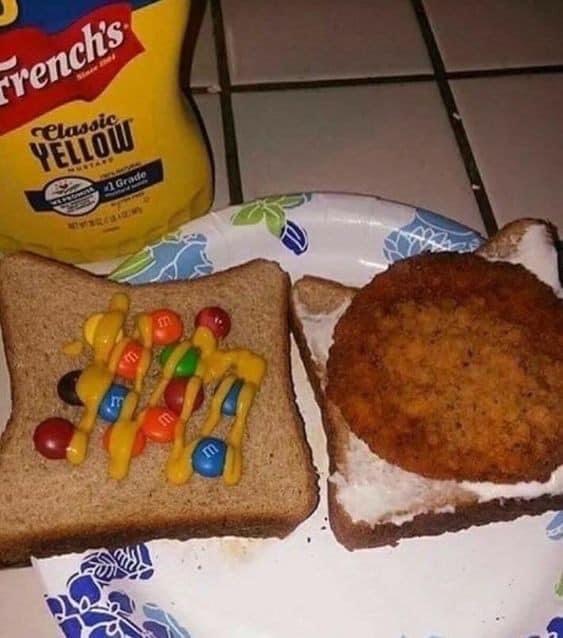
I want to click on tile chip, so click(217, 89).